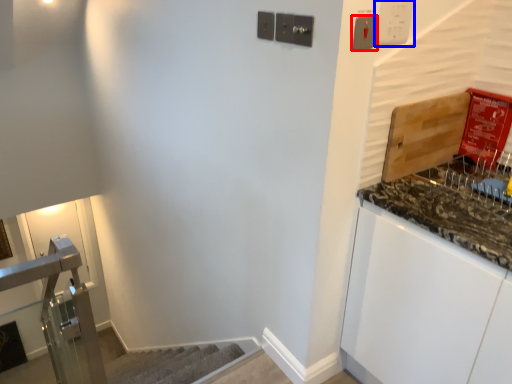
Question: Among these objects, which one is farthest to the camera, light switch (highlighted by a red box) or light switch (highlighted by a blue box)?

Choices:
 (A) light switch
 (B) light switch

Answer: (B)